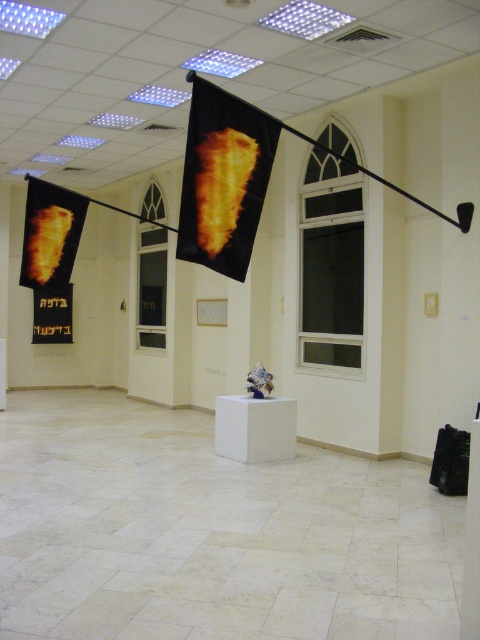
Does black matte flag at center have a greater height compared to flame-patterned fabric banner at left?

Yes, black matte flag at center is taller than flame-patterned fabric banner at left.

From the picture: Is black matte flag at center in front of flame-patterned fabric banner at left?

Yes.

Which is in front, point (229, 220) or point (36, 218)?

Positioned in front is point (229, 220).

The height and width of the screenshot is (640, 480). Identify the location of black matte flag at center. (224, 179).